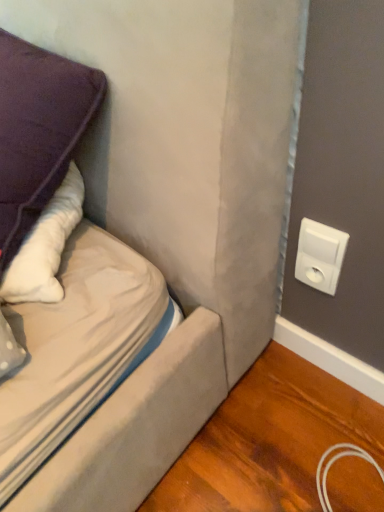
Question: Can you confirm if purple fabric pillow at upper left is positioned to the right of white plastic outlet at upper right?

Choices:
 (A) no
 (B) yes

Answer: (A)

Question: Is the position of purple fabric pillow at upper left more distant than that of white plastic outlet at upper right?

Choices:
 (A) yes
 (B) no

Answer: (B)

Question: Does purple fabric pillow at upper left appear on the left side of white plastic outlet at upper right?

Choices:
 (A) no
 (B) yes

Answer: (B)

Question: Is purple fabric pillow at upper left completely or partially outside of white plastic outlet at upper right?

Choices:
 (A) yes
 (B) no

Answer: (A)

Question: Is purple fabric pillow at upper left beside white plastic outlet at upper right?

Choices:
 (A) no
 (B) yes

Answer: (A)

Question: Does purple fabric pillow at upper left have a larger size compared to white plastic outlet at upper right?

Choices:
 (A) no
 (B) yes

Answer: (B)

Question: Can you confirm if white plastic outlet at upper right is taller than purple fabric pillow at upper left?

Choices:
 (A) no
 (B) yes

Answer: (A)

Question: Considering the relative sizes of white plastic outlet at upper right and purple fabric pillow at upper left in the image provided, is white plastic outlet at upper right shorter than purple fabric pillow at upper left?

Choices:
 (A) no
 (B) yes

Answer: (B)

Question: Is white plastic outlet at upper right bigger than purple fabric pillow at upper left?

Choices:
 (A) yes
 (B) no

Answer: (B)

Question: Is white plastic outlet at upper right positioned before purple fabric pillow at upper left?

Choices:
 (A) no
 (B) yes

Answer: (A)

Question: From a real-world perspective, is white plastic outlet at upper right positioned under purple fabric pillow at upper left based on gravity?

Choices:
 (A) yes
 (B) no

Answer: (A)

Question: Is white plastic outlet at upper right wider than purple fabric pillow at upper left?

Choices:
 (A) no
 (B) yes

Answer: (A)

Question: Considering the positions of white plastic outlet at upper right and purple fabric pillow at upper left in the image, is white plastic outlet at upper right taller or shorter than purple fabric pillow at upper left?

Choices:
 (A) tall
 (B) short

Answer: (B)